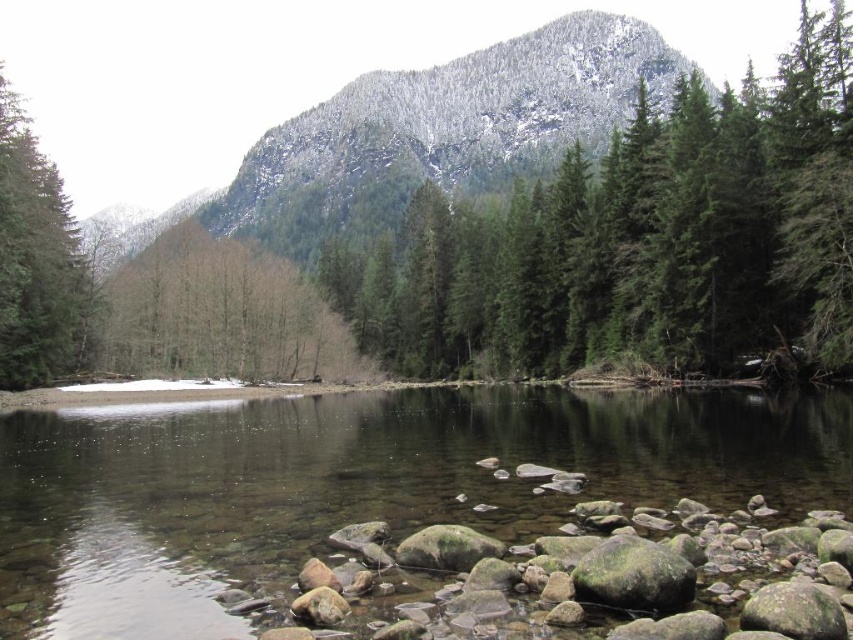
Which of these two, green matte tree at center or snow-covered rock at upper center, stands shorter?

A: green matte tree at center is shorter.

Does green matte tree at center appear over snow-covered rock at upper center?

No, green matte tree at center is not above snow-covered rock at upper center.

The height and width of the screenshot is (640, 853). Identify the location of green matte tree at center. tap(639, 241).

In the scene shown: Is clear smooth water at center to the left of snow-covered rock at upper center from the viewer's perspective?

No, clear smooth water at center is not to the left of snow-covered rock at upper center.

Who is positioned more to the right, clear smooth water at center or snow-covered rock at upper center?

Positioned to the right is clear smooth water at center.

Describe the element at coordinates (358, 484) in the screenshot. I see `clear smooth water at center` at that location.

Locate an element on the screen. This screenshot has height=640, width=853. clear smooth water at center is located at coordinates (358, 484).

Is point (563, 504) less distant than point (16, 99)?

Yes, it is in front of point (16, 99).

Identify the location of clear smooth water at center. (358, 484).

Between point (289, 474) and point (0, 236), which one is positioned in front?

Point (289, 474) is more forward.

The image size is (853, 640). What are the coordinates of `clear smooth water at center` in the screenshot? It's located at (358, 484).